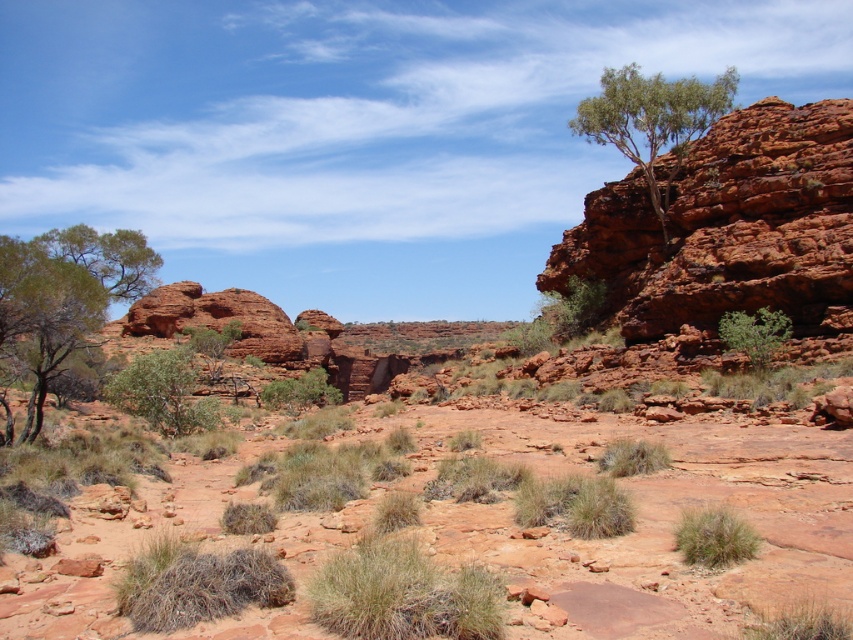
You are standing at the point marked by the coordinates point (163,392) in the desert landscape. What do you see directly in front of you?

You see a green leafy tree at center directly in front of you at the coordinates point (163,392).

You are a hiker trying to navigate through the desert and see the green leafy tree at left and the green leafy tree at center. Which tree is closer to you?

The green leafy tree at left is closer to you since it is positioned in front of the green leafy tree at center.